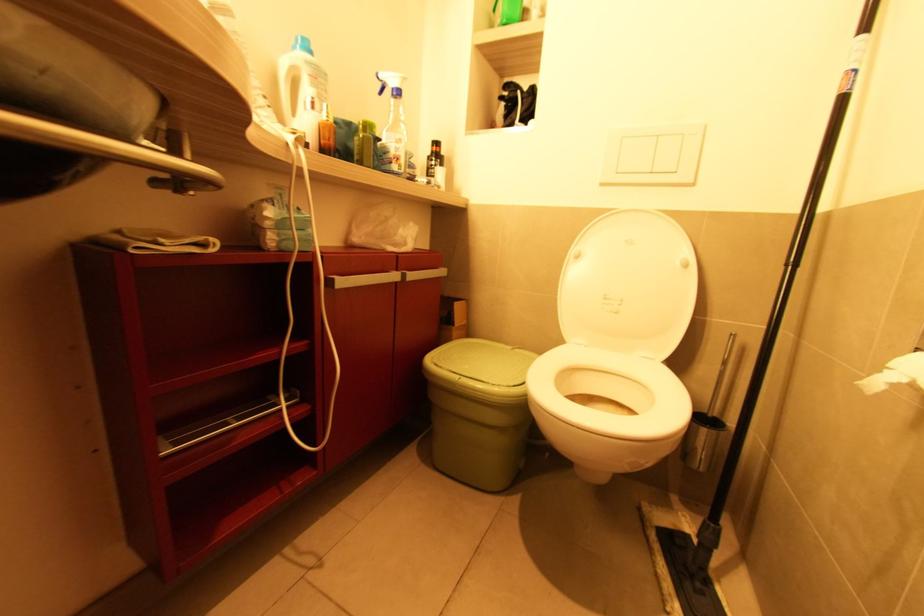
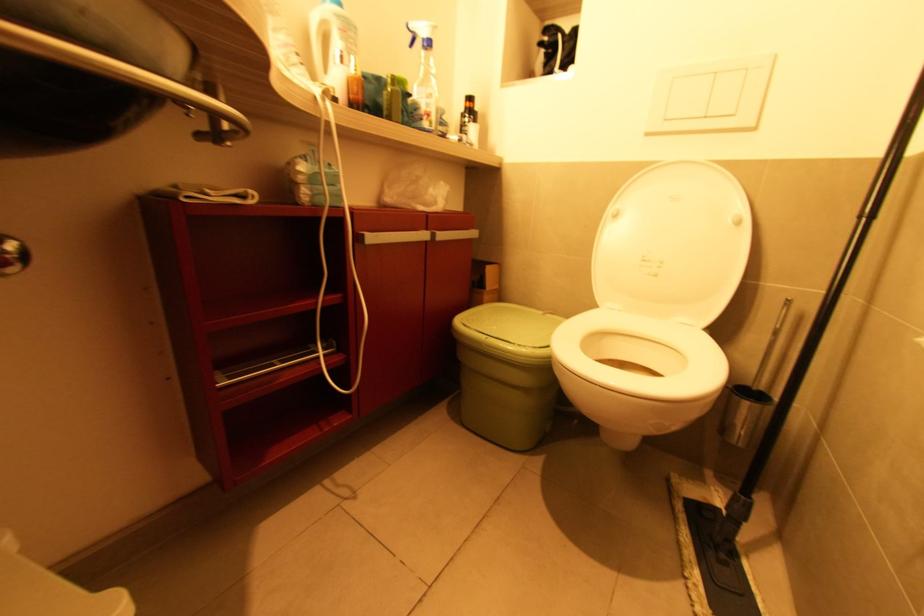
In the second image, find the point that corresponds to [579,257] in the first image.

(617, 217)